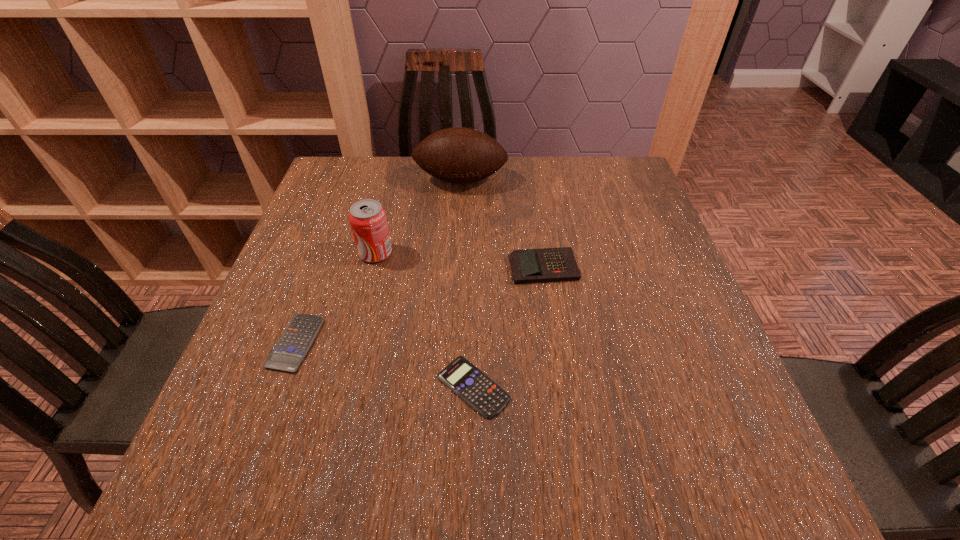
Where is `object that stands as the closest to the second calculator from right to left`? The image size is (960, 540). object that stands as the closest to the second calculator from right to left is located at coordinates (547, 264).

Identify the location of calculator that is the second closest one to the third shortest object. Image resolution: width=960 pixels, height=540 pixels. (287, 355).

This screenshot has width=960, height=540. I want to click on the third closest calculator to the soda can, so click(x=480, y=392).